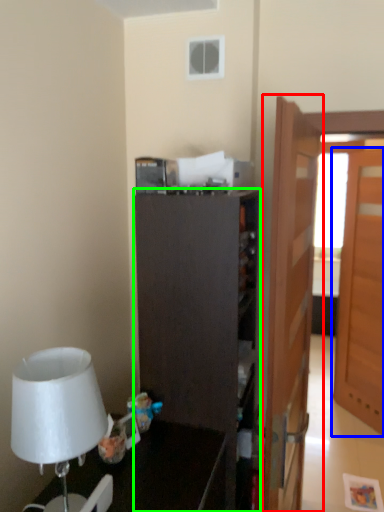
Question: Which is nearer to the door (highlighted by a red box)? door (highlighted by a blue box) or cabinetry (highlighted by a green box).

Choices:
 (A) door
 (B) cabinetry

Answer: (B)